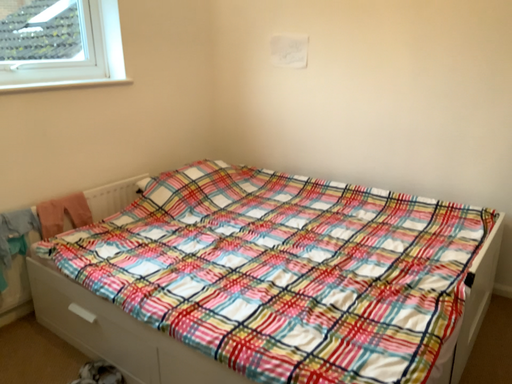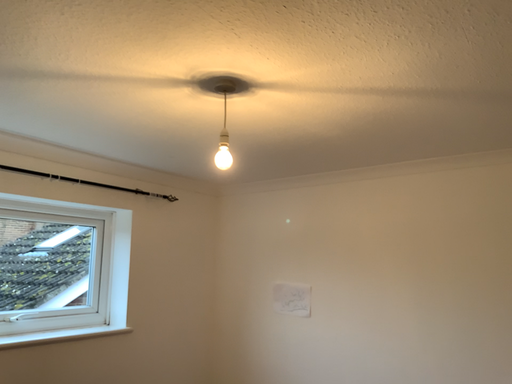
Question: Which way did the camera rotate in the video?

Choices:
 (A) rotated downward
 (B) rotated upward

Answer: (B)